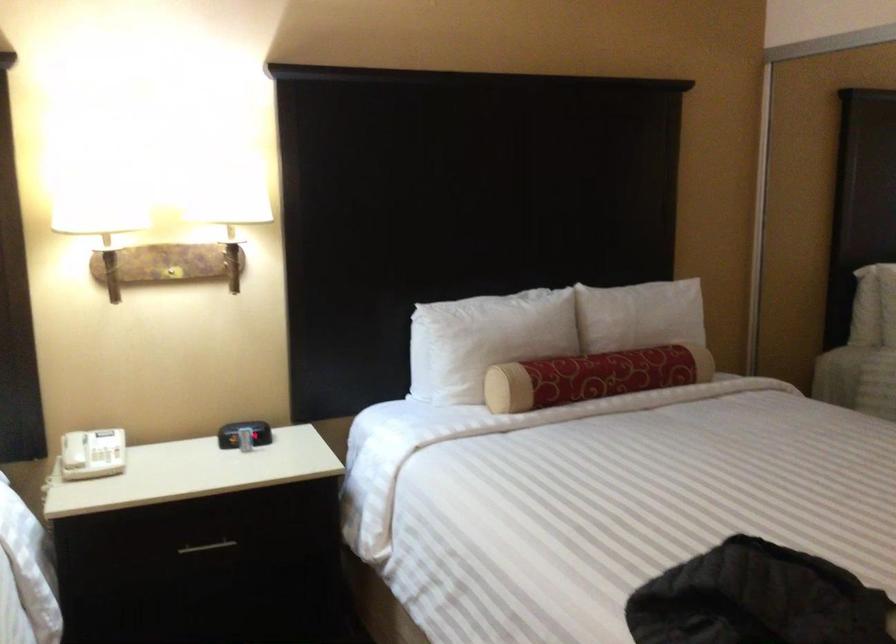
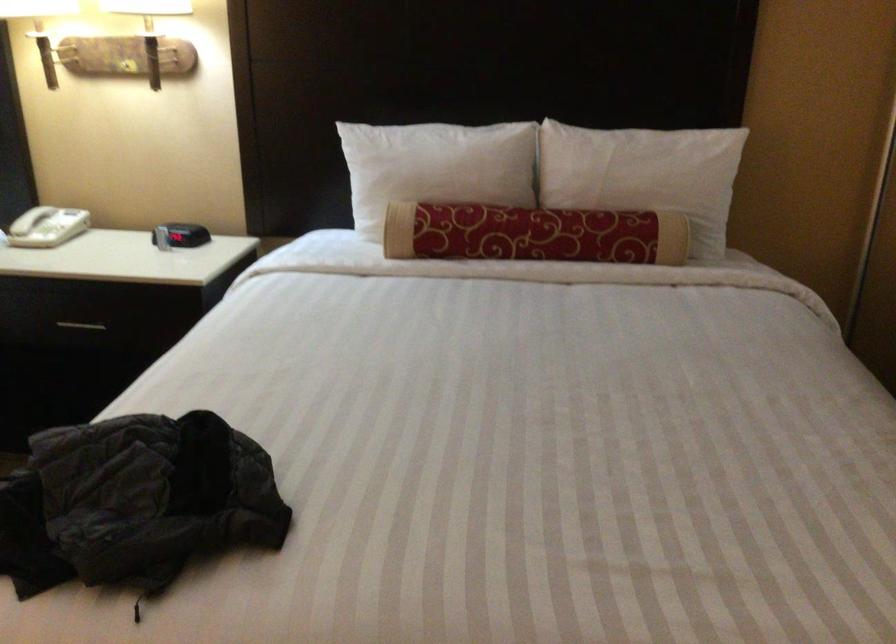
The point at (x=520, y=330) is marked in the first image. Where is the corresponding point in the second image?

(435, 167)